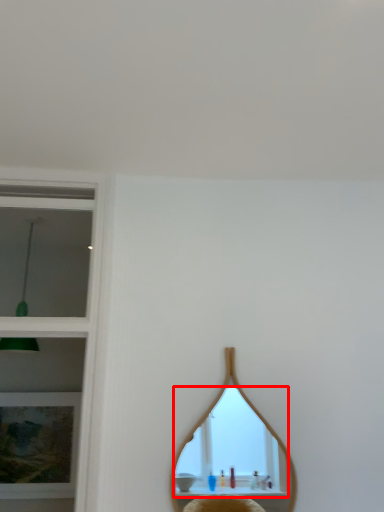
Question: From the image's perspective, what is the correct spatial positioning of mirror (annotated by the red box) in reference to picture frame?

Choices:
 (A) below
 (B) above

Answer: (B)